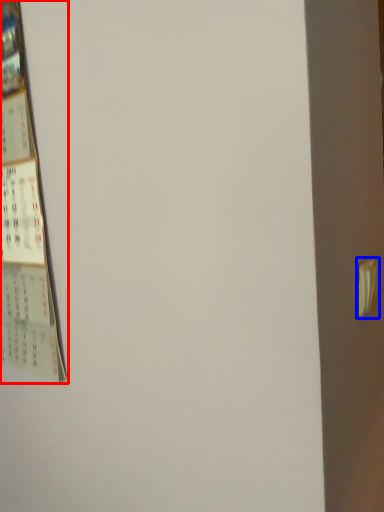
Question: Which point is further to the camera, poster (highlighted by a red box) or door handle (highlighted by a blue box)?

Choices:
 (A) poster
 (B) door handle

Answer: (A)